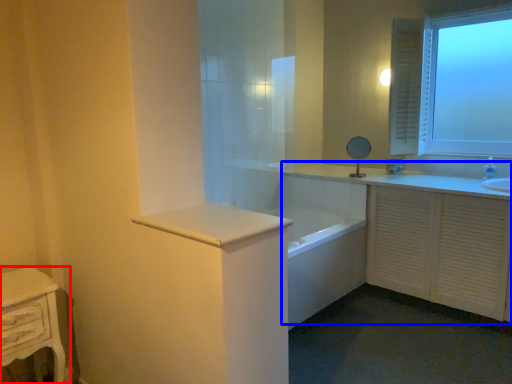
Question: Which of the following is the farthest to the observer, nightstand (highlighted by a red box) or bathroom cabinet (highlighted by a blue box)?

Choices:
 (A) nightstand
 (B) bathroom cabinet

Answer: (B)